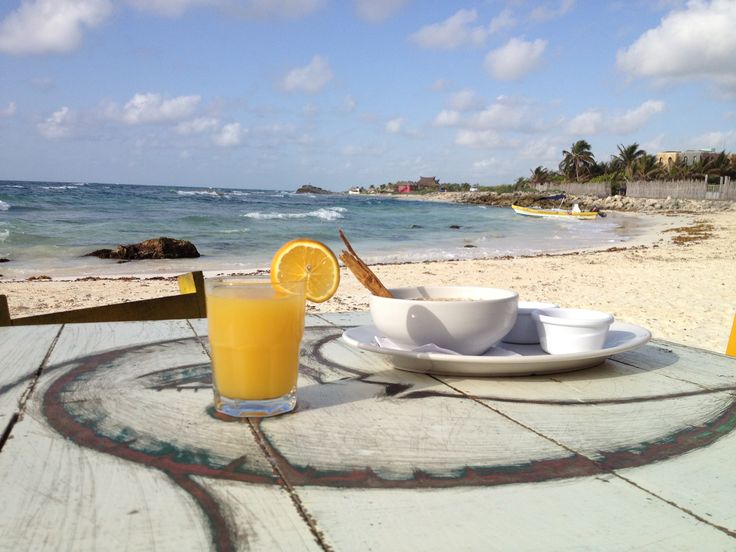
I want to click on ramikins, so click(542, 330), click(522, 328).